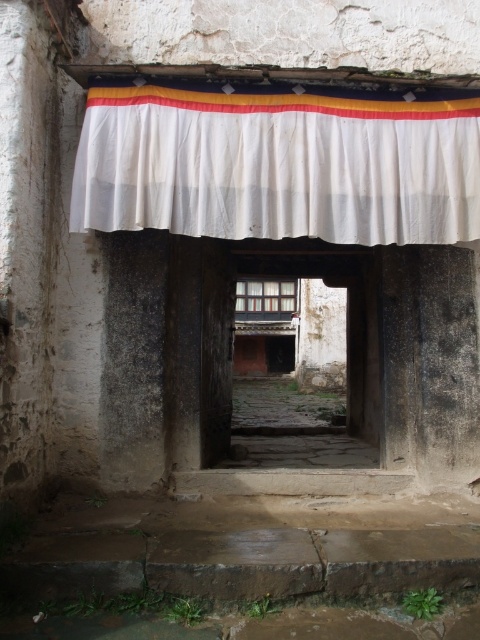
You are standing in the entranceway and looking at two points marked on the ground. The first point is at coordinates point (x=228, y=177) and the second point is at point (x=358, y=321). Which point is closer to you?

Point (x=228, y=177) is in front of point (x=358, y=321), so it is closer to you.

You are standing in the entranceway and want to hang a new banner above the existing draped fabric banner. The new banner must be placed at the point indicated by the coordinates point (277, 166). According to the image, what object is currently at that location?

The point (277, 166) indicates the location of the white fabric curtain at upper center.

You are a visitor approaching the entranceway and want to enter through the wooden door at center. As you look up, you notice the white fabric curtain at upper center. Which object is closer to the top of the entranceway?

The white fabric curtain at upper center is closer to the top of the entranceway because it is shorter than the wooden door at center, meaning it is positioned higher up.